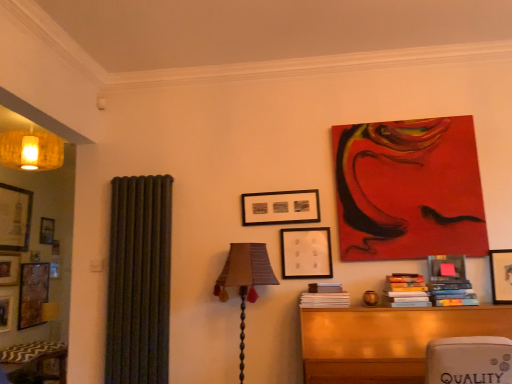
Question: From a real-world perspective, is wooden picture frame at upper right, the third picture frame in the back-to-front sequence, positioned under matte black picture frame at center, arranged as the second picture frame when viewed from the left, based on gravity?

Choices:
 (A) yes
 (B) no

Answer: (A)

Question: From a real-world perspective, is wooden picture frame at upper right, the third picture frame in the back-to-front sequence, positioned over matte black picture frame at center, which is the 2th picture frame from back to front, based on gravity?

Choices:
 (A) yes
 (B) no

Answer: (B)

Question: Is wooden picture frame at upper right, the 1th picture frame positioned from the front, positioned with its back to matte black picture frame at center, placed as the 2th picture frame when sorted from front to back?

Choices:
 (A) no
 (B) yes

Answer: (A)

Question: Is wooden picture frame at upper right, the third picture frame positioned from the left, facing towards matte black picture frame at center, which is the 2th picture frame from back to front?

Choices:
 (A) no
 (B) yes

Answer: (A)

Question: Considering the relative sizes of wooden picture frame at upper right, the 1th picture frame positioned from the front, and matte black picture frame at center, placed as the 2th picture frame when sorted from front to back, in the image provided, is wooden picture frame at upper right, the 1th picture frame positioned from the front, bigger than matte black picture frame at center, placed as the 2th picture frame when sorted from front to back,?

Choices:
 (A) no
 (B) yes

Answer: (B)

Question: Relative to wooden picture frame at upper right, the third picture frame in the back-to-front sequence, is hardcover books at center-right, the 2th book viewed from the left, in front or behind?

Choices:
 (A) front
 (B) behind

Answer: (B)

Question: Considering the relative positions of hardcover books at center-right, which appears as the 2th book when viewed from the right, and wooden picture frame at upper right, the third picture frame in the back-to-front sequence, in the image provided, is hardcover books at center-right, which appears as the 2th book when viewed from the right, to the left or to the right of wooden picture frame at upper right, the third picture frame in the back-to-front sequence,?

Choices:
 (A) right
 (B) left

Answer: (B)

Question: Considering the positions of hardcover books at center-right, which appears as the 2th book when viewed from the right, and wooden picture frame at upper right, the third picture frame in the back-to-front sequence, in the image, is hardcover books at center-right, which appears as the 2th book when viewed from the right, taller or shorter than wooden picture frame at upper right, the third picture frame in the back-to-front sequence,?

Choices:
 (A) short
 (B) tall

Answer: (A)

Question: Choose the correct answer: Is hardcover books at center-right, the 2th book viewed from the left, inside wooden picture frame at upper right, the third picture frame positioned from the left, or outside it?

Choices:
 (A) outside
 (B) inside

Answer: (A)

Question: From the image's perspective, is textured fabric lampshade at center located above or below matte black picture frame at center, arranged as the second picture frame when viewed from the left?

Choices:
 (A) below
 (B) above

Answer: (A)

Question: Considering their positions, is textured fabric lampshade at center located in front of or behind matte black picture frame at center, placed as the 2th picture frame when sorted from front to back?

Choices:
 (A) front
 (B) behind

Answer: (A)

Question: Is textured fabric lampshade at center wider or thinner than matte black picture frame at center, placed as the 2th picture frame when sorted from front to back?

Choices:
 (A) thin
 (B) wide

Answer: (B)

Question: In terms of height, does textured fabric lampshade at center look taller or shorter compared to matte black picture frame at center, arranged as the second picture frame when viewed from the left?

Choices:
 (A) tall
 (B) short

Answer: (A)

Question: From a real-world perspective, is wooden table at lower right physically located above or below matte black picture frame at center, which is the 2th picture frame from back to front?

Choices:
 (A) below
 (B) above

Answer: (A)

Question: From the image's perspective, is wooden table at lower right positioned above or below matte black picture frame at center, placed as the 2th picture frame when sorted from front to back?

Choices:
 (A) above
 (B) below

Answer: (B)